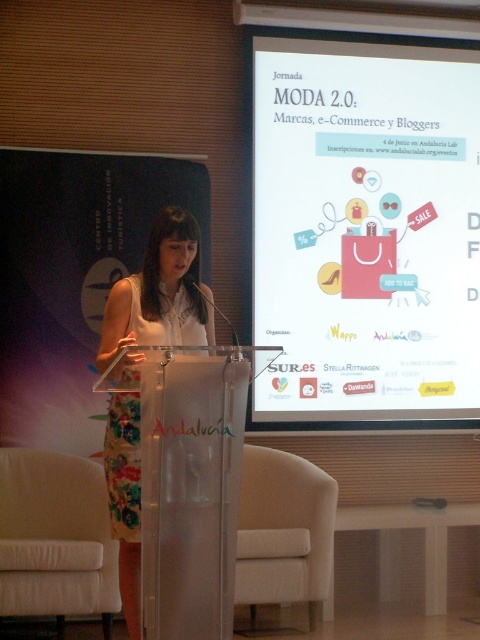
Between white paper at upper center and floral fabric dress at center, which one is positioned lower?

floral fabric dress at center is lower down.

Does white paper at upper center appear on the left side of floral fabric dress at center?

In fact, white paper at upper center is to the right of floral fabric dress at center.

The width and height of the screenshot is (480, 640). What do you see at coordinates (365, 230) in the screenshot?
I see `white paper at upper center` at bounding box center [365, 230].

At what (x,y) coordinates should I click in order to perform the action: click on white paper at upper center. Please return your answer as a coordinate pair (x, y). This screenshot has height=640, width=480. Looking at the image, I should click on (365, 230).